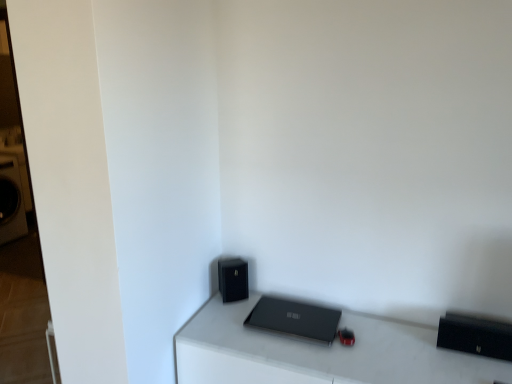
Question: Is black matte speaker at lower center closer to camera compared to matte black laptop at center?

Choices:
 (A) yes
 (B) no

Answer: (B)

Question: Considering the relative sizes of black matte speaker at lower center and matte black laptop at center in the image provided, is black matte speaker at lower center taller than matte black laptop at center?

Choices:
 (A) no
 (B) yes

Answer: (A)

Question: From a real-world perspective, is black matte speaker at lower center below matte black laptop at center?

Choices:
 (A) no
 (B) yes

Answer: (A)

Question: Is black matte speaker at lower center smaller than matte black laptop at center?

Choices:
 (A) no
 (B) yes

Answer: (B)

Question: Does black matte speaker at lower center appear on the left side of matte black laptop at center?

Choices:
 (A) yes
 (B) no

Answer: (A)

Question: Would you say black matte speaker at lower center contains matte black laptop at center?

Choices:
 (A) no
 (B) yes

Answer: (A)

Question: From a real-world perspective, does matte black laptop at center stand above black matte speaker at lower center?

Choices:
 (A) no
 (B) yes

Answer: (A)

Question: Considering the relative sizes of matte black laptop at center and black matte speaker at lower center in the image provided, is matte black laptop at center shorter than black matte speaker at lower center?

Choices:
 (A) yes
 (B) no

Answer: (B)

Question: From the image's perspective, would you say matte black laptop at center is shown under black matte speaker at lower center?

Choices:
 (A) no
 (B) yes

Answer: (B)

Question: Can you confirm if matte black laptop at center is taller than black matte speaker at lower center?

Choices:
 (A) no
 (B) yes

Answer: (B)

Question: Does matte black laptop at center appear on the right side of black matte speaker at lower center?

Choices:
 (A) yes
 (B) no

Answer: (A)

Question: Does matte black laptop at center have a lesser width compared to black matte speaker at lower center?

Choices:
 (A) no
 (B) yes

Answer: (A)

Question: Considering the relative positions of matte black laptop at center and black matte speaker at lower center in the image provided, is matte black laptop at center to the right of black matte speaker at lower center from the viewer's perspective?

Choices:
 (A) no
 (B) yes

Answer: (B)